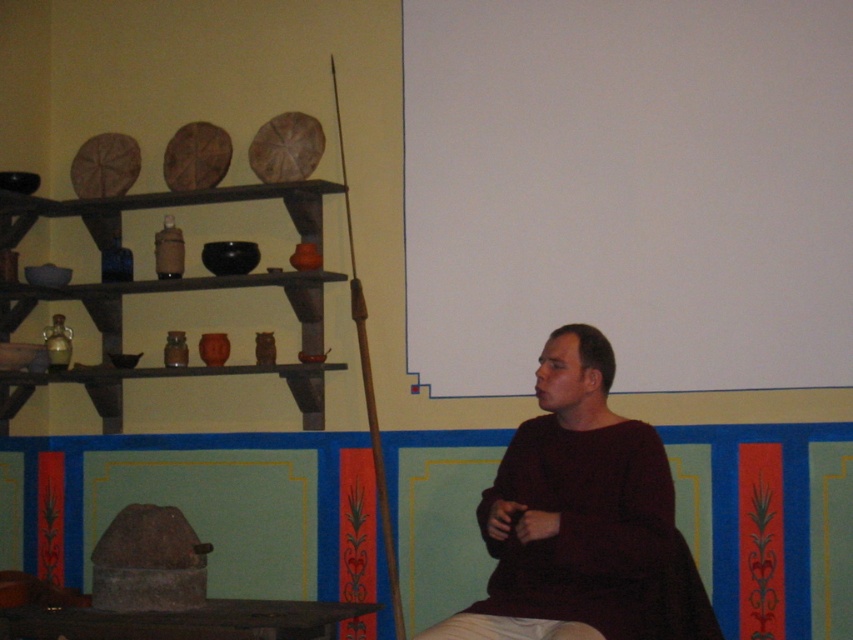
Question: Does white matte projection screen at upper center have a lesser width compared to brown wood shelves at left?

Choices:
 (A) no
 (B) yes

Answer: (A)

Question: Which object is closer to the camera taking this photo?

Choices:
 (A) brown wood shelves at left
 (B) dark brown sweater at center

Answer: (B)

Question: Which point is closer to the camera?

Choices:
 (A) dark brown sweater at center
 (B) white matte projection screen at upper center

Answer: (A)

Question: Is white matte projection screen at upper center thinner than brown wood shelves at left?

Choices:
 (A) yes
 (B) no

Answer: (B)

Question: Considering the real-world distances, which object is farthest from the dark brown sweater at center?

Choices:
 (A) brown wood shelves at left
 (B) white matte projection screen at upper center

Answer: (A)

Question: Does white matte projection screen at upper center have a greater width compared to brown wood shelves at left?

Choices:
 (A) yes
 (B) no

Answer: (A)